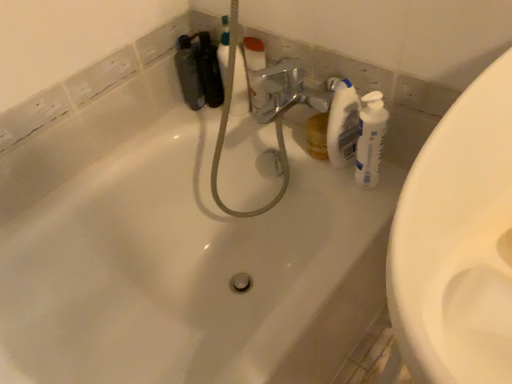
Question: From a real-world perspective, is white glossy bathtub at center located higher than translucent plastic bottle at upper right, acting as the first cleaning product starting from the left?

Choices:
 (A) no
 (B) yes

Answer: (A)

Question: Is white glossy bathtub at center aimed at translucent plastic bottle at upper right, acting as the first cleaning product starting from the left?

Choices:
 (A) yes
 (B) no

Answer: (B)

Question: Is white glossy bathtub at center at the left side of translucent plastic bottle at upper right, acting as the 2th cleaning product starting from the right?

Choices:
 (A) yes
 (B) no

Answer: (A)

Question: Can you confirm if white glossy bathtub at center is thinner than translucent plastic bottle at upper right, acting as the first cleaning product starting from the left?

Choices:
 (A) no
 (B) yes

Answer: (A)

Question: Is white glossy bathtub at center next to translucent plastic bottle at upper right, acting as the first cleaning product starting from the left?

Choices:
 (A) no
 (B) yes

Answer: (A)

Question: Does white glossy bathtub at center have a greater width compared to translucent plastic bottle at upper right, acting as the 2th cleaning product starting from the right?

Choices:
 (A) yes
 (B) no

Answer: (A)

Question: Is white plastic bottle at right, placed as the second cleaning product when sorted from left to right, next to translucent plastic bottle at upper right, acting as the first cleaning product starting from the left?

Choices:
 (A) yes
 (B) no

Answer: (A)

Question: Is white plastic bottle at right, the first cleaning product positioned from the right, at the left side of translucent plastic bottle at upper right, acting as the first cleaning product starting from the left?

Choices:
 (A) yes
 (B) no

Answer: (B)

Question: Does white plastic bottle at right, placed as the second cleaning product when sorted from left to right, have a greater height compared to translucent plastic bottle at upper right, acting as the first cleaning product starting from the left?

Choices:
 (A) yes
 (B) no

Answer: (B)

Question: Is white plastic bottle at right, placed as the second cleaning product when sorted from left to right, shorter than translucent plastic bottle at upper right, acting as the first cleaning product starting from the left?

Choices:
 (A) yes
 (B) no

Answer: (A)

Question: Is white plastic bottle at right, the first cleaning product positioned from the right, positioned in front of translucent plastic bottle at upper right, acting as the 2th cleaning product starting from the right?

Choices:
 (A) no
 (B) yes

Answer: (B)

Question: Does white plastic bottle at right, the first cleaning product positioned from the right, have a smaller size compared to translucent plastic bottle at upper right, acting as the first cleaning product starting from the left?

Choices:
 (A) yes
 (B) no

Answer: (B)

Question: Does matte black bottle at upper left come in front of translucent plastic bottle at upper right, acting as the 2th cleaning product starting from the right?

Choices:
 (A) no
 (B) yes

Answer: (A)